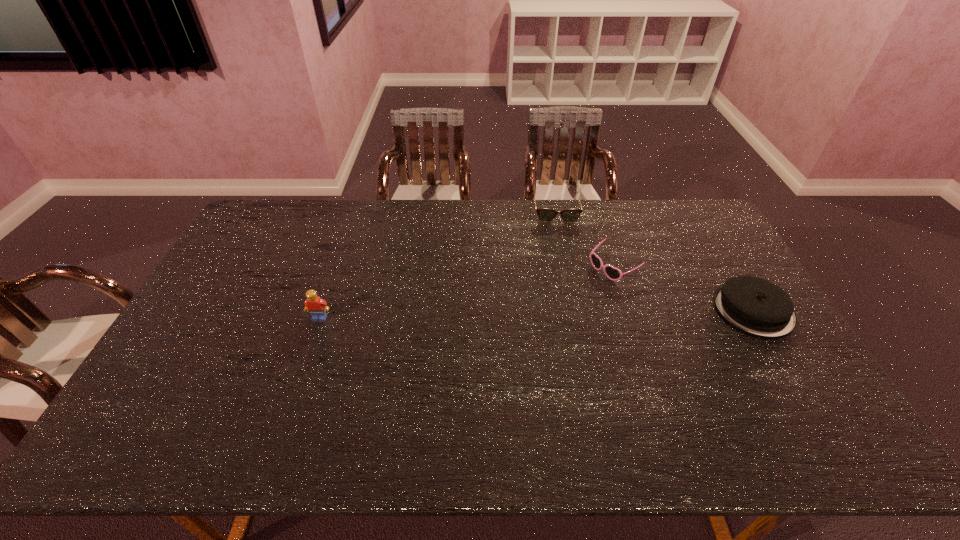
The height and width of the screenshot is (540, 960). What are the coordinates of `Lego` in the screenshot? It's located at (317, 307).

The width and height of the screenshot is (960, 540). What are the coordinates of `the leftmost object` in the screenshot? It's located at (317, 307).

Image resolution: width=960 pixels, height=540 pixels. In order to click on the rightmost object in this screenshot , I will do `click(755, 306)`.

The image size is (960, 540). In order to click on sunglasses in this screenshot , I will do `click(612, 273)`.

Where is `spectacles`? spectacles is located at coordinates (544, 214).

In order to click on vacant space located 0.150m on the front-facing side of the leftmost object in this screenshot , I will do `click(304, 364)`.

At what (x,y) coordinates should I click in order to perform the action: click on vacant region located 0.150m on the left of the rightmost object. Please return your answer as a coordinate pair (x, y). The height and width of the screenshot is (540, 960). Looking at the image, I should click on (665, 309).

Locate an element on the screen. Image resolution: width=960 pixels, height=540 pixels. free space located on the front-facing side of the sunglasses is located at coordinates (560, 302).

The width and height of the screenshot is (960, 540). Find the location of `vacant region located 0.190m on the front-facing side of the sunglasses`. vacant region located 0.190m on the front-facing side of the sunglasses is located at coordinates (555, 305).

Locate an element on the screen. This screenshot has height=540, width=960. vacant area located on the front-facing side of the sunglasses is located at coordinates pyautogui.click(x=571, y=295).